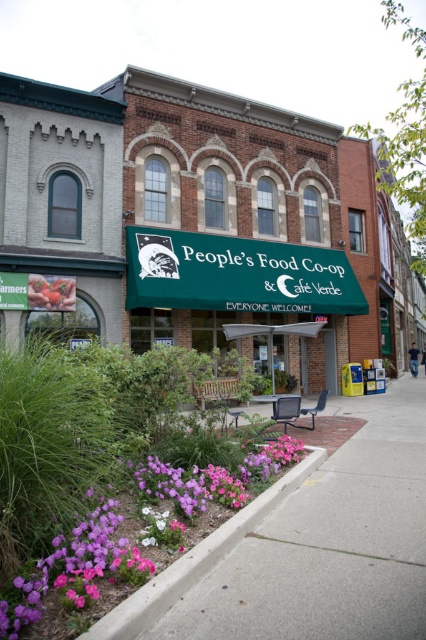
You are standing in front of the People Food Coop and Cafe Verde. You see two points on the building facade. The first point is at coordinate point (393, 616) and the second is at point (155, 612). Which point is closer to you?

Point (393, 616) is in front of point (155, 612), so the first point is closer to you.

You are a delivery person trying to park your 1.2 meter wide delivery cart in the area near the People Food Co Op and Cafe Verde. You see the paved concrete sidewalk at lower center and the concrete at lower center. Which one is a better spot to park your cart?

The paved concrete sidewalk at lower center is located below the concrete at lower center. Since the sidewalk is paved and designed for pedestrians, it might be more suitable for parking the delivery cart as it is likely wider and more accessible. However, the exact width isn